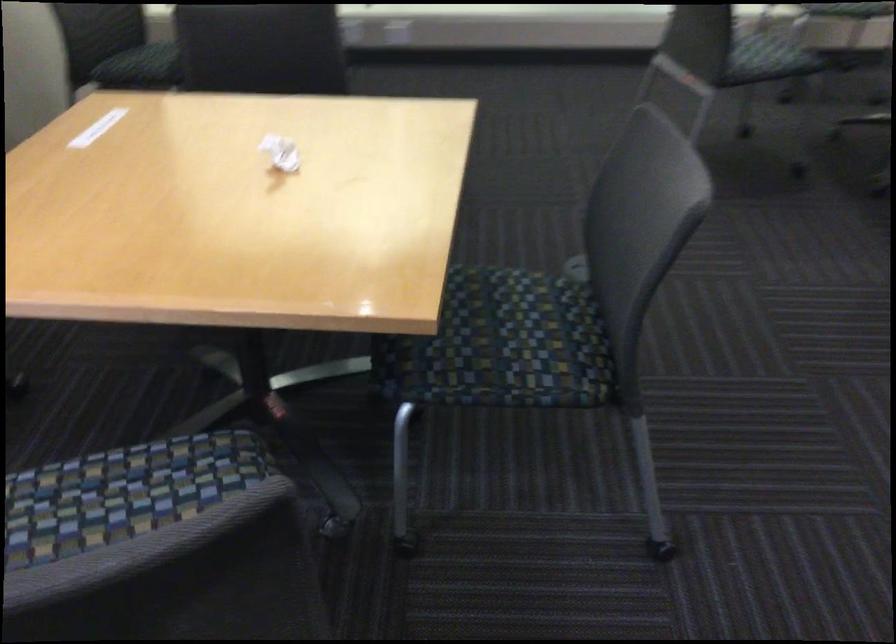
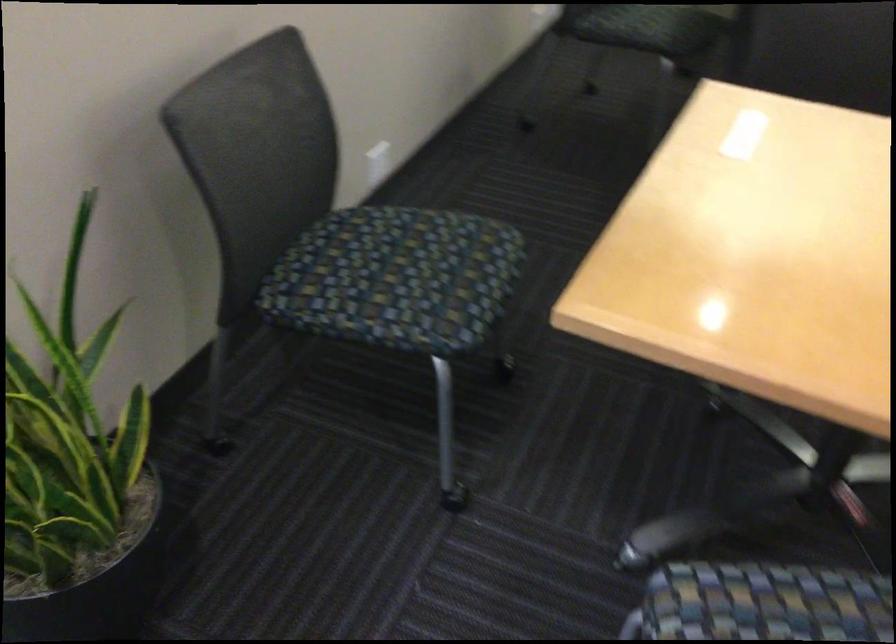
Question: The first image is from the beginning of the video and the second image is from the end. How did the camera likely rotate when shooting the video?

Choices:
 (A) Left
 (B) Right
 (C) Up
 (D) Down

Answer: (A)